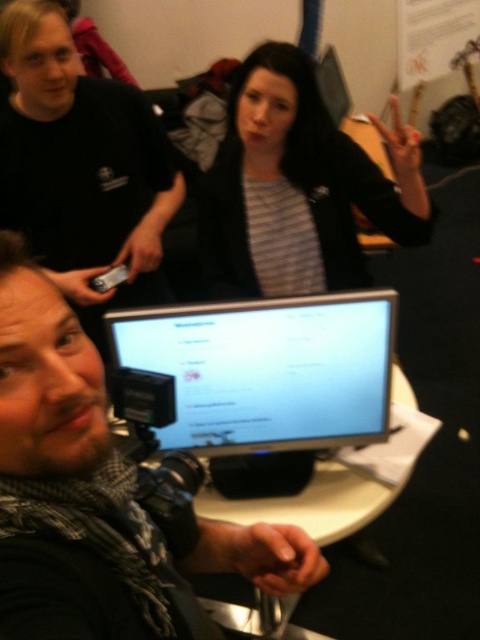
Question: Does bearded man at center have a greater width compared to matte black camera at lower left?

Choices:
 (A) no
 (B) yes

Answer: (A)

Question: Which object is farther from the camera taking this photo?

Choices:
 (A) matte black monitor at center
 (B) bearded man at center

Answer: (A)

Question: Where is bearded man at center located in relation to matte black monitor at center in the image?

Choices:
 (A) above
 (B) below

Answer: (B)

Question: Which of the following is the farthest from the observer?

Choices:
 (A) bearded man at center
 (B) black matte jacket at upper center
 (C) matte black monitor at center

Answer: (B)

Question: Can you confirm if black matte jacket at upper center is positioned below matte black monitor at center?

Choices:
 (A) yes
 (B) no

Answer: (B)

Question: Which is farther from the matte black monitor at center?

Choices:
 (A) bearded man at center
 (B) matte black camera at lower left

Answer: (B)